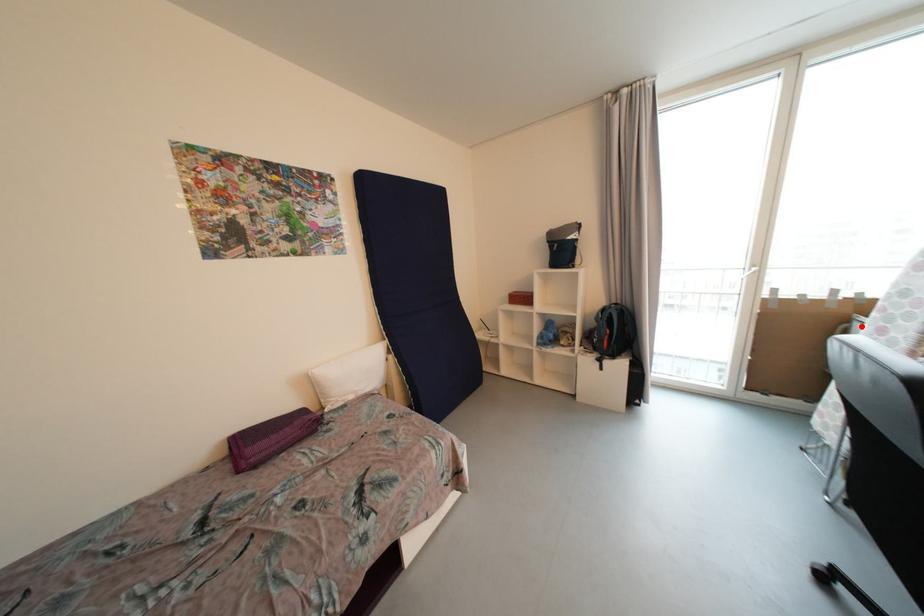
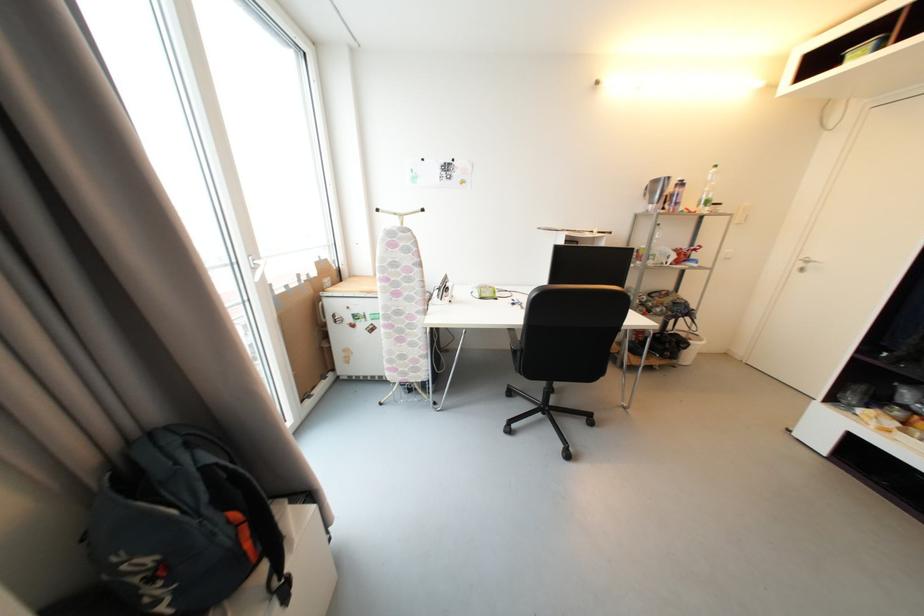
Question: I am providing you with two images of the same scene from different viewpoints. Image1 has a red point marked. In image2, the corresponding 3D location appears at what relative position? Reply with the corresponding letter.

Choices:
 (A) Closer
 (B) Farther

Answer: (A)